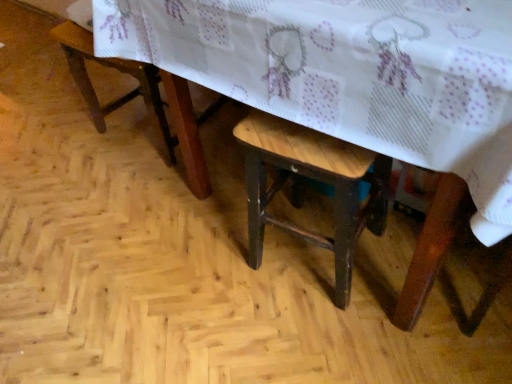
Locate an element on the screen. The image size is (512, 384). vacant space to the right of wooden stool at center is located at coordinates (408, 264).